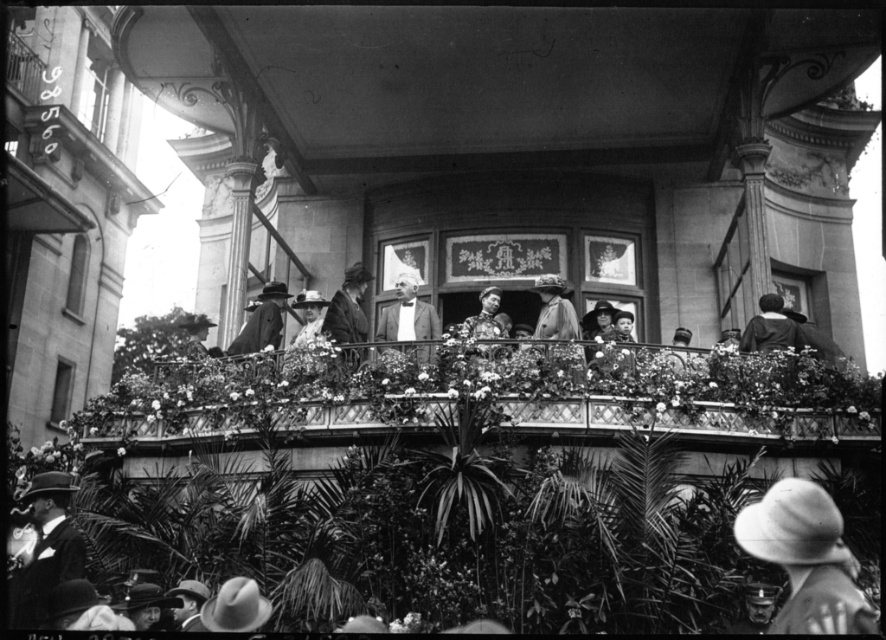
Question: Is light gray fabric suit at center thinner than smooth leather jacket at center?

Choices:
 (A) yes
 (B) no

Answer: (B)

Question: Which object appears closest to the camera in this image?

Choices:
 (A) smooth black coat at upper right
 (B) matte black coat at left

Answer: (A)

Question: Among these points, which one is nearest to the camera?

Choices:
 (A) (35, 484)
 (B) (471, 326)
 (C) (778, 332)
 (D) (424, 326)

Answer: (A)

Question: Considering the relative positions of light gray fabric suit at center and matte black coat at left in the image provided, where is light gray fabric suit at center located with respect to matte black coat at left?

Choices:
 (A) below
 (B) above

Answer: (A)

Question: Is wooden railing at center below smooth brown coat at center?

Choices:
 (A) no
 (B) yes

Answer: (B)

Question: Estimate the real-world distances between objects in this image. Which object is closer to the matte black coat at left?

Choices:
 (A) wooden railing at center
 (B) smooth leather jacket at center

Answer: (A)